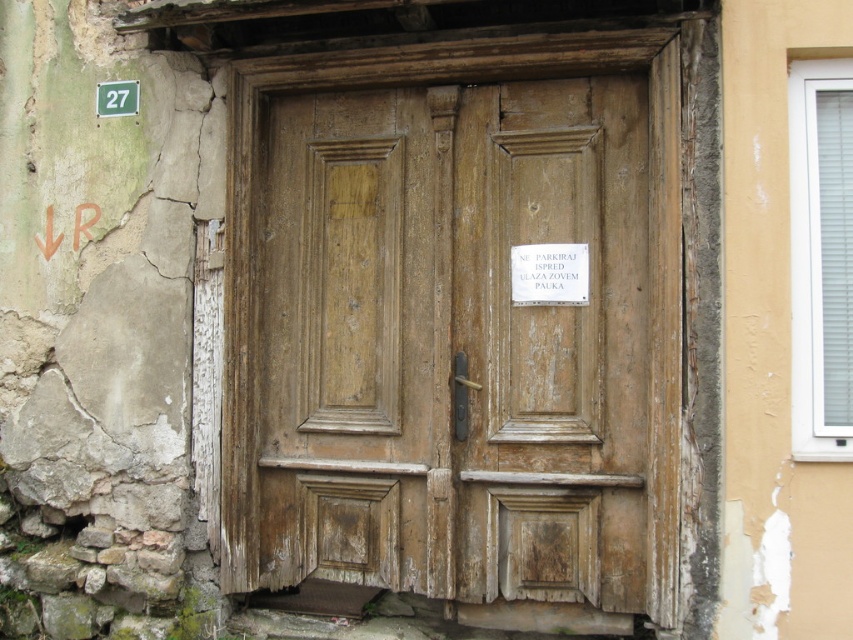
Question: Considering the real-world distances, which object is closest to the weathered wood door at center?

Choices:
 (A) white paper sign at center
 (B) green plastic sign at upper left

Answer: (A)

Question: Which of the following is the closest to the observer?

Choices:
 (A) weathered wood door at center
 (B) white paper sign at center
 (C) green plastic sign at upper left

Answer: (A)

Question: Can you confirm if weathered wood door at center is positioned to the left of white paper sign at center?

Choices:
 (A) yes
 (B) no

Answer: (A)

Question: Which of the following is the farthest from the observer?

Choices:
 (A) white paper sign at center
 (B) green plastic sign at upper left
 (C) weathered wood door at center

Answer: (B)

Question: Can you confirm if weathered wood door at center is positioned to the right of green plastic sign at upper left?

Choices:
 (A) no
 (B) yes

Answer: (B)

Question: Is white paper sign at center above green plastic sign at upper left?

Choices:
 (A) no
 (B) yes

Answer: (A)